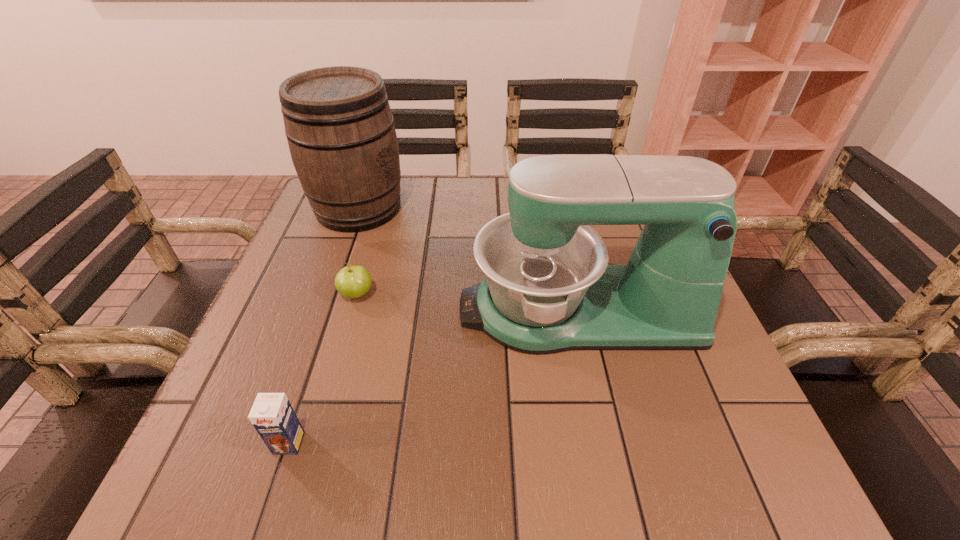
In the image, there is a desktop. Where is `vacant space at the left edge`? The width and height of the screenshot is (960, 540). vacant space at the left edge is located at coordinates (238, 392).

The image size is (960, 540). What are the coordinates of `free space at the right edge of the desktop` in the screenshot? It's located at (660, 400).

Identify the location of vacant space at the near right corner of the desktop. (693, 480).

Image resolution: width=960 pixels, height=540 pixels. What are the coordinates of `free space between the wine bucket and the chocolate milk` in the screenshot? It's located at (324, 325).

Image resolution: width=960 pixels, height=540 pixels. Identify the location of free space between the wine bucket and the rightmost object. (468, 259).

The width and height of the screenshot is (960, 540). What are the coordinates of `empty location between the wine bucket and the apple` in the screenshot? It's located at (358, 251).

The width and height of the screenshot is (960, 540). Identify the location of free space between the nearest object and the farthest object. (324, 325).

At what (x,y) coordinates should I click in order to perform the action: click on vacant region between the rightmost object and the wine bucket. Please return your answer as a coordinate pair (x, y). This screenshot has width=960, height=540. Looking at the image, I should click on (468, 259).

Find the location of a particular element. This screenshot has width=960, height=540. unoccupied position between the wine bucket and the rightmost object is located at coordinates (468, 259).

At what (x,y) coordinates should I click in order to perform the action: click on vacant area between the rightmost object and the wine bucket. Please return your answer as a coordinate pair (x, y). The width and height of the screenshot is (960, 540). Looking at the image, I should click on 468,259.